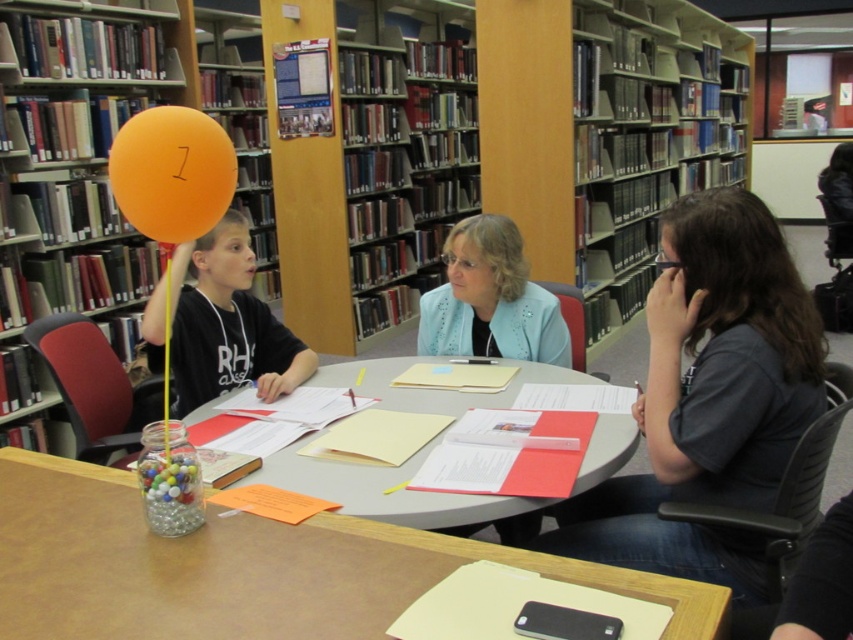
You are a librarian who needs to place a new book on the tallest object in the library. Which object should you choose between the wooden bookshelf at left and the clear plastic table at center?

The wooden bookshelf at left is taller than the clear plastic table at center, so you should place the new book on the wooden bookshelf at left.

Where is the matte black shirt at center located in the image?

The matte black shirt at center is located at point coordinates of 0.506 on the x axis and 0.267 on the y axis.

You are standing at the center of the table in the library scene. There are two points marked on the table surface. The first point is at coordinates point (308, 561) and the second point is at point (403, 394). Which point is closer to you?

Point (308, 561) is in front of point (403, 394), so it is closer to you.